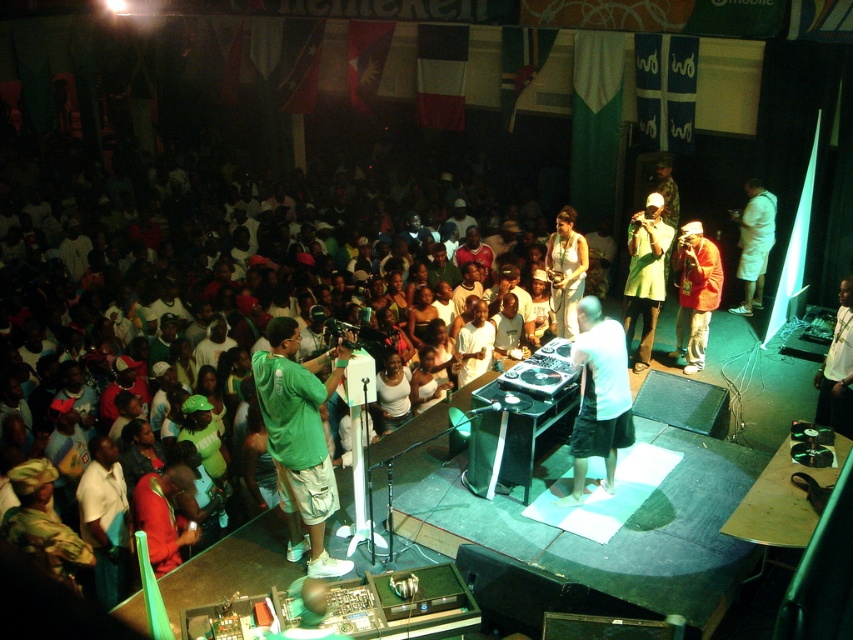
Question: Is green matte shirt at lower left wider than white cotton shirt at right?

Choices:
 (A) yes
 (B) no

Answer: (A)

Question: Which of these objects is positioned farthest from the white cotton crowd at lower left?

Choices:
 (A) white cotton shirt at right
 (B) green matte shirt at lower left

Answer: (A)

Question: Is the position of green matte shirt at lower left more distant than that of white cotton shirt at right?

Choices:
 (A) no
 (B) yes

Answer: (A)

Question: Which of the following is the closest to the observer?

Choices:
 (A) (747, 234)
 (B) (376, 307)

Answer: (B)

Question: Does white cotton crowd at lower left have a smaller size compared to white cotton shirt at right?

Choices:
 (A) no
 (B) yes

Answer: (A)

Question: Considering the real-world distances, which object is closest to the white cotton shirt at right?

Choices:
 (A) white cotton crowd at lower left
 (B) green matte shirt at lower left

Answer: (A)